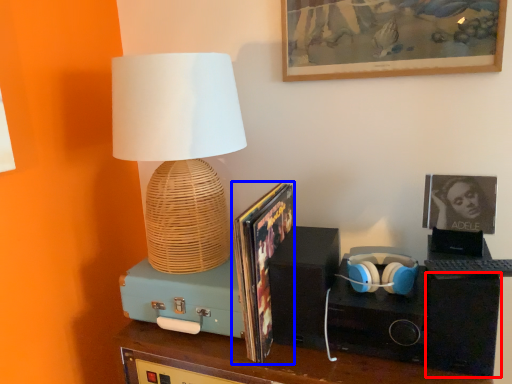
Question: Which object appears farthest to the camera in this image, speaker (highlighted by a red box) or magazine (highlighted by a blue box)?

Choices:
 (A) speaker
 (B) magazine

Answer: (B)